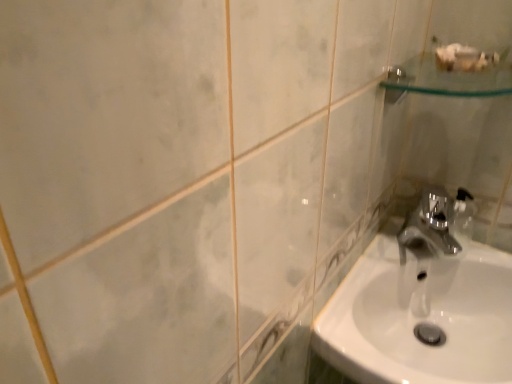
I want to click on white glossy sink at lower right, so click(x=423, y=303).

Image resolution: width=512 pixels, height=384 pixels. Describe the element at coordinates (423, 303) in the screenshot. I see `white glossy sink at lower right` at that location.

Image resolution: width=512 pixels, height=384 pixels. What are the coordinates of `white glossy sink at lower right` in the screenshot? It's located at (423, 303).